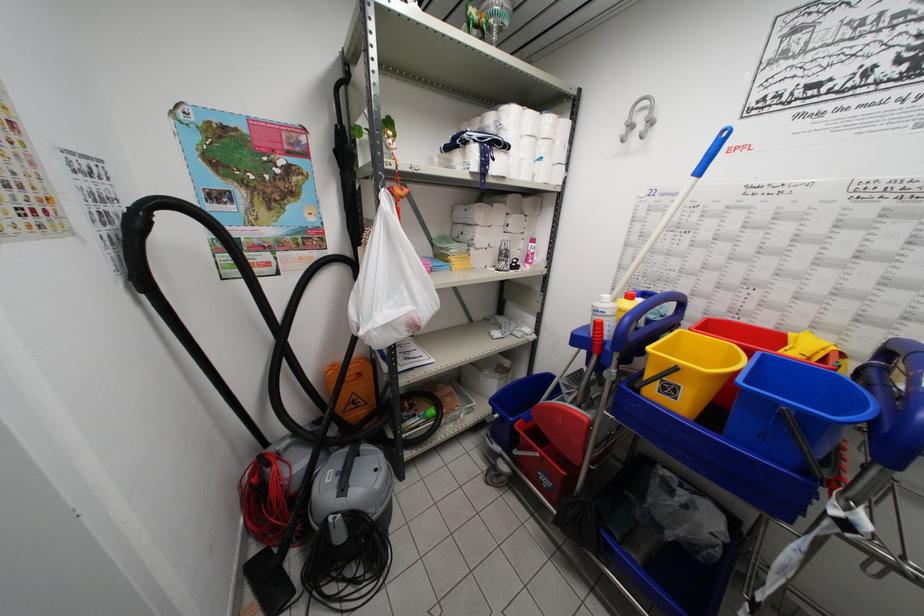
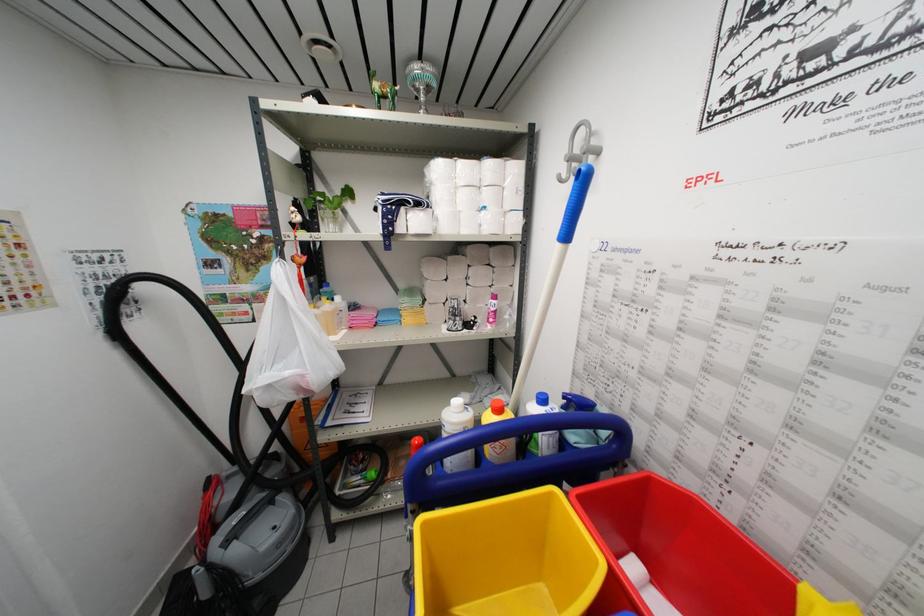
Locate, in the second image, the point that corresponds to the point at 545,153 in the first image.

(490, 201)